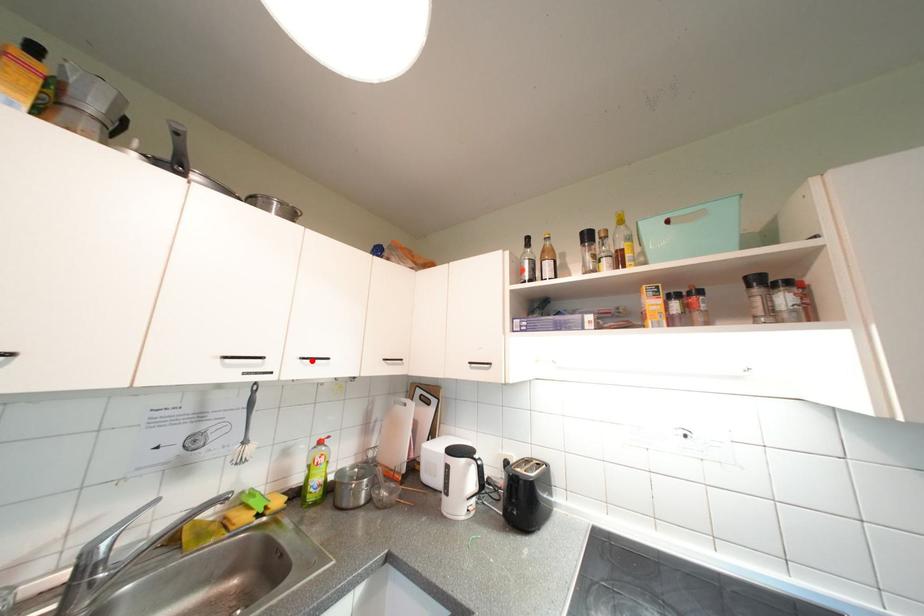
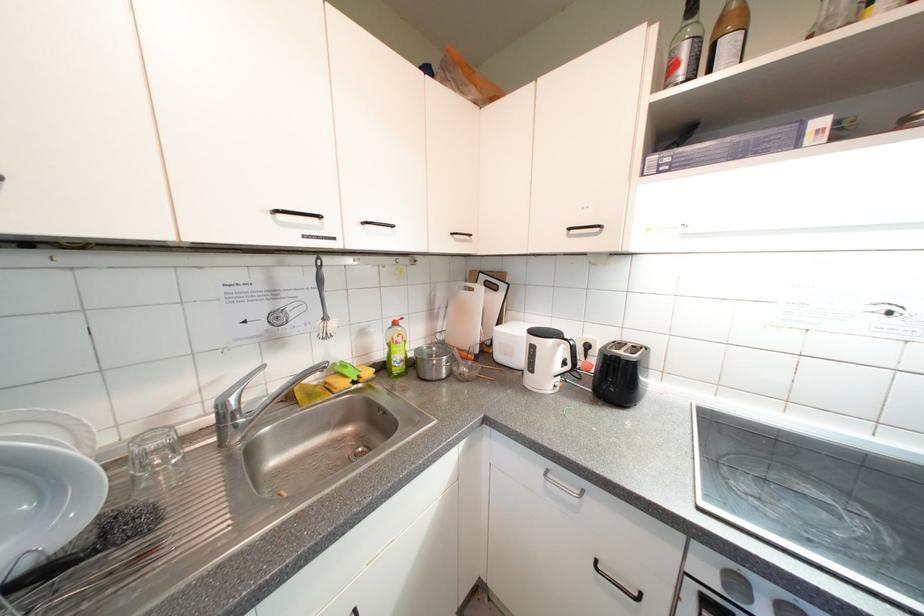
Where in the second image is the point corresponding to the highlighted location from the first image?

(373, 225)